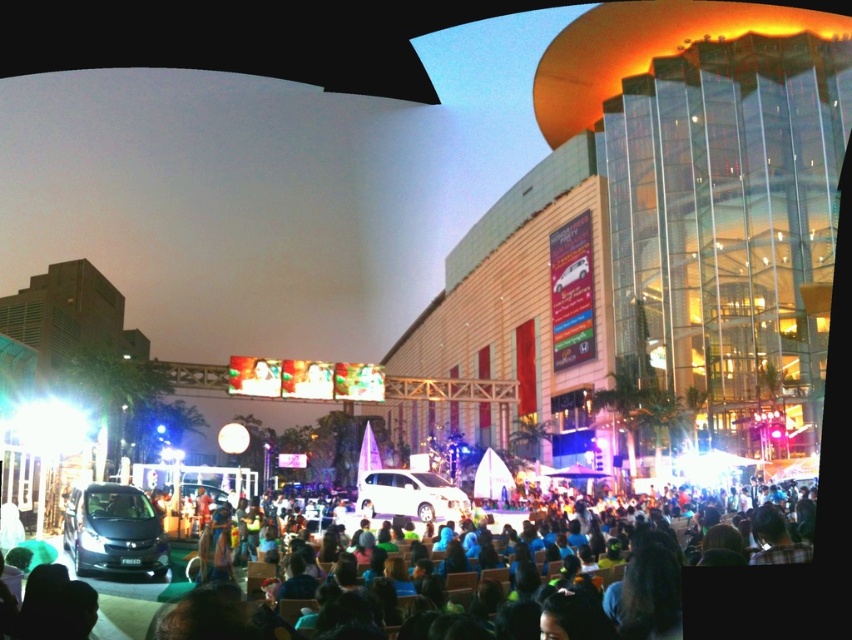
Is shiny black minivan at lower left below white glossy minivan at center?

Yes, shiny black minivan at lower left is below white glossy minivan at center.

The image size is (852, 640). Describe the element at coordinates (114, 531) in the screenshot. I see `shiny black minivan at lower left` at that location.

The width and height of the screenshot is (852, 640). Describe the element at coordinates (114, 531) in the screenshot. I see `shiny black minivan at lower left` at that location.

Locate an element on the screen. Image resolution: width=852 pixels, height=640 pixels. shiny black minivan at lower left is located at coordinates (114, 531).

Who is shorter, green fabric crowd at lower center or shiny black minivan at lower left?

shiny black minivan at lower left

Where is `green fabric crowd at lower center`? green fabric crowd at lower center is located at coordinates (205, 618).

From the picture: Is green fabric crowd at lower center positioned at the back of white glossy minivan at center?

No.

Between green fabric crowd at lower center and white glossy minivan at center, which one is positioned lower?

Positioned lower is green fabric crowd at lower center.

Identify the location of green fabric crowd at lower center. (205, 618).

Find the location of a particular element. The height and width of the screenshot is (640, 852). green fabric crowd at lower center is located at coordinates (205, 618).